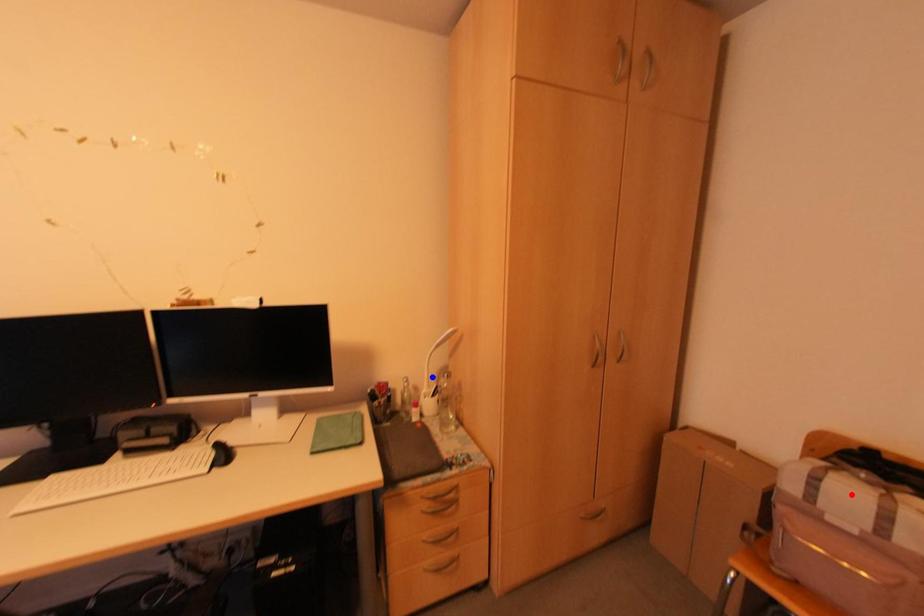
Question: In the image, two points are highlighted. Which point is nearer to the camera? Reply with the corresponding letter.

Choices:
 (A) blue point
 (B) red point

Answer: (B)